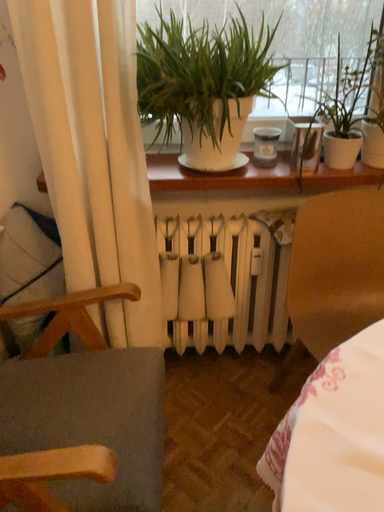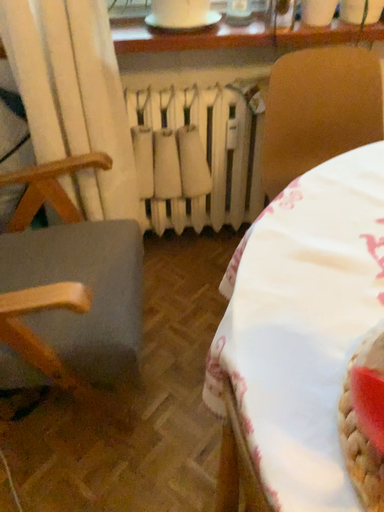
Question: Which way did the camera rotate in the video?

Choices:
 (A) rotated upward
 (B) rotated downward

Answer: (B)